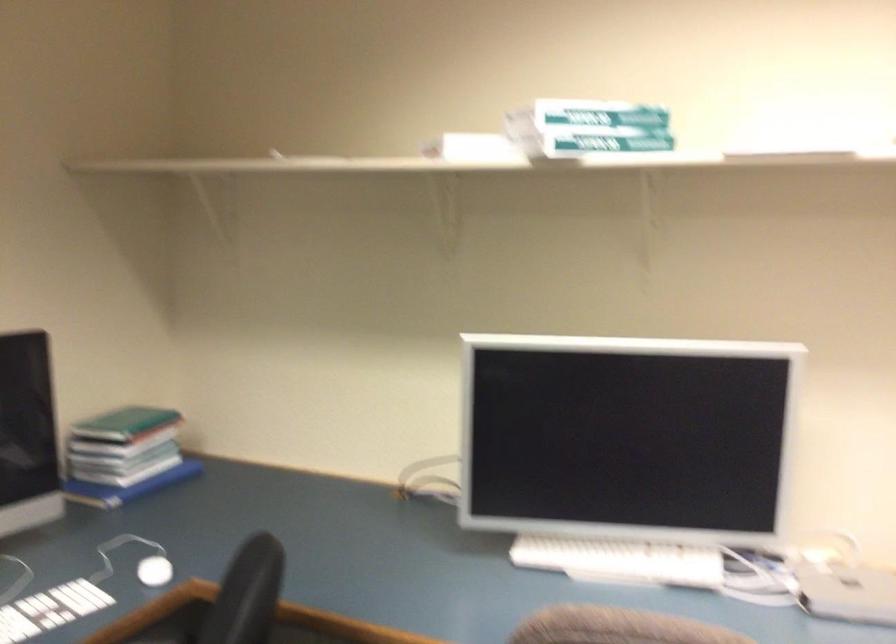
At what (x,y) coordinates should I click in order to perform the action: click on blue book. Please return your answer as a coordinate pair (x, y). This screenshot has width=896, height=644. Looking at the image, I should click on 115,493.